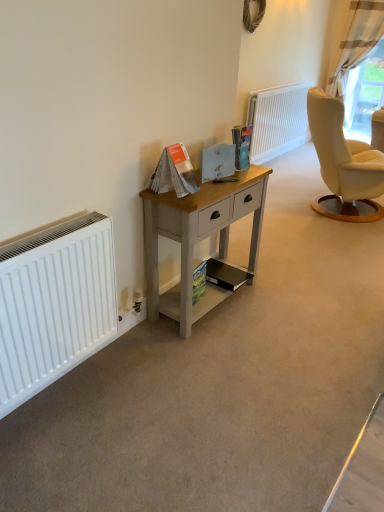
Question: Is white matte radiator at upper center, which is counted as the second radiator, starting from the left, turned away from white textured curtain at upper right?

Choices:
 (A) yes
 (B) no

Answer: (B)

Question: Considering the relative sizes of white matte radiator at upper center, which is counted as the second radiator, starting from the left, and white textured curtain at upper right in the image provided, is white matte radiator at upper center, which is counted as the second radiator, starting from the left, taller than white textured curtain at upper right?

Choices:
 (A) no
 (B) yes

Answer: (A)

Question: Would you say white textured curtain at upper right is part of white matte radiator at upper center, which ranks as the second radiator in bottom-to-top order,'s contents?

Choices:
 (A) no
 (B) yes

Answer: (A)

Question: Is white matte radiator at upper center, which is the second radiator in front-to-back order, bigger than white textured curtain at upper right?

Choices:
 (A) no
 (B) yes

Answer: (A)

Question: Is white matte radiator at upper center, which is counted as the second radiator, starting from the left, behind white textured curtain at upper right?

Choices:
 (A) yes
 (B) no

Answer: (B)

Question: In the image, is white matte radiator at upper center, which appears as the first radiator when viewed from the top, positioned in front of or behind matte black magazine at lower center, which is the 4th magazine from top to bottom?

Choices:
 (A) front
 (B) behind

Answer: (B)

Question: Looking at the image, does white matte radiator at upper center, which is the second radiator in front-to-back order, seem bigger or smaller compared to matte black magazine at lower center, which ranks as the 2th magazine in bottom-to-top order?

Choices:
 (A) big
 (B) small

Answer: (A)

Question: Is white matte radiator at upper center, which is counted as the second radiator, starting from the left, inside the boundaries of matte black magazine at lower center, which ranks as the 2th magazine in bottom-to-top order, or outside?

Choices:
 (A) inside
 (B) outside

Answer: (B)

Question: Considering the positions of white matte radiator at upper center, which is counted as the first radiator, starting from the back, and matte black magazine at lower center, which ranks as the 2th magazine in bottom-to-top order, in the image, is white matte radiator at upper center, which is counted as the first radiator, starting from the back, taller or shorter than matte black magazine at lower center, which ranks as the 2th magazine in bottom-to-top order,?

Choices:
 (A) tall
 (B) short

Answer: (A)

Question: Is point (236, 284) positioned closer to the camera than point (241, 158)?

Choices:
 (A) closer
 (B) farther

Answer: (B)

Question: From the image's perspective, is matte black magazine at lower center, which ranks as the 2th magazine in bottom-to-top order, positioned above or below matte paper magazine at center, which is the first magazine from top to bottom?

Choices:
 (A) below
 (B) above

Answer: (A)

Question: Is matte black magazine at lower center, which ranks as the 2th magazine in bottom-to-top order, to the left or to the right of matte paper magazine at center, the 5th magazine when ordered from bottom to top, in the image?

Choices:
 (A) left
 (B) right

Answer: (A)

Question: Do you think matte black magazine at lower center, which ranks as the 2th magazine in bottom-to-top order, is within matte paper magazine at center, the 5th magazine when ordered from bottom to top, or outside of it?

Choices:
 (A) inside
 (B) outside

Answer: (B)

Question: Considering the positions of point (226, 279) and point (206, 158), is point (226, 279) closer or farther from the camera than point (206, 158)?

Choices:
 (A) farther
 (B) closer

Answer: (A)

Question: In the image, is matte black magazine at lower center, which ranks as the 2th magazine in bottom-to-top order, positioned in front of or behind matte blue card at center, which is counted as the second magazine, starting from the top?

Choices:
 (A) front
 (B) behind

Answer: (B)